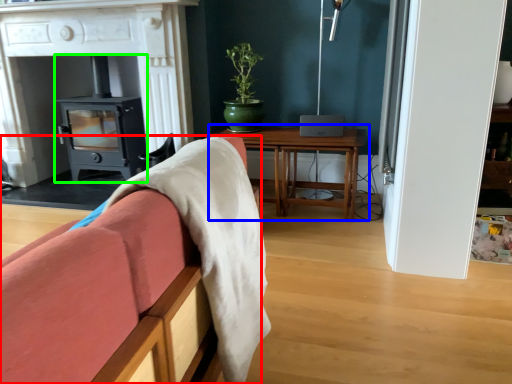
Question: Which is nearer to the furniture (highlighted by a red box)? table (highlighted by a blue box) or wood burning stove (highlighted by a green box).

Choices:
 (A) table
 (B) wood burning stove

Answer: (A)